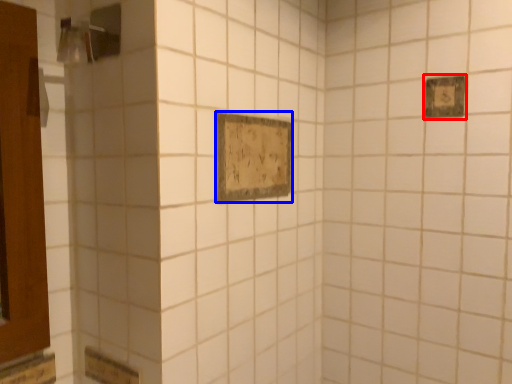
Question: Which of the following is the farthest to the observer, rectangle (highlighted by a red box) or rectangle (highlighted by a blue box)?

Choices:
 (A) rectangle
 (B) rectangle

Answer: (A)